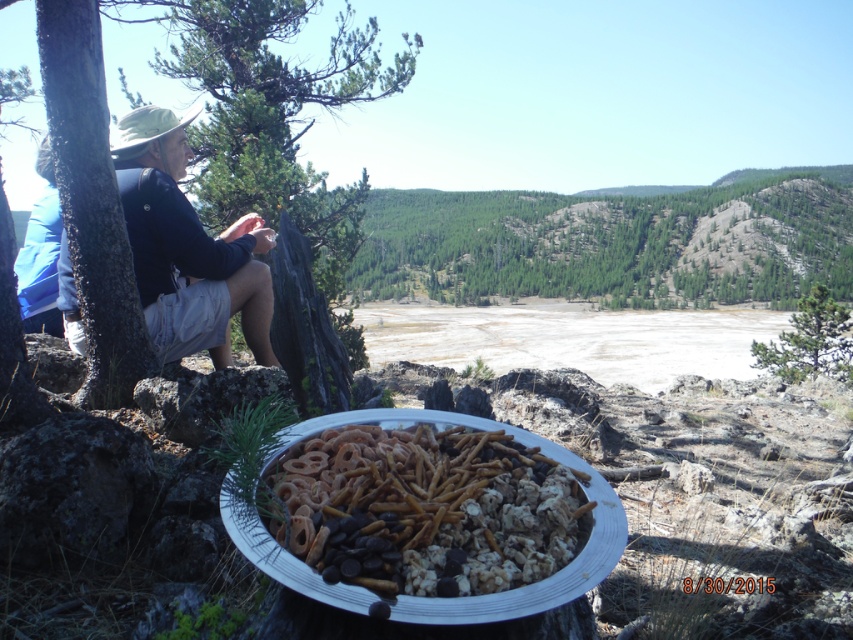
Based on the scene description, where is the green leafy tree at center located in terms of coordinates?

The green leafy tree at center is located at point coordinates of (613, 243).

You are planning to set up a picnic blanket between the green leafy tree at center and the green textured pine tree at center. Which tree should you place the blanket closer to if you want it to be shaded by the taller tree?

The green leafy tree at center is taller than the green textured pine tree at center, so you should place the picnic blanket closer to the green leafy tree at center to be shaded by its taller canopy.